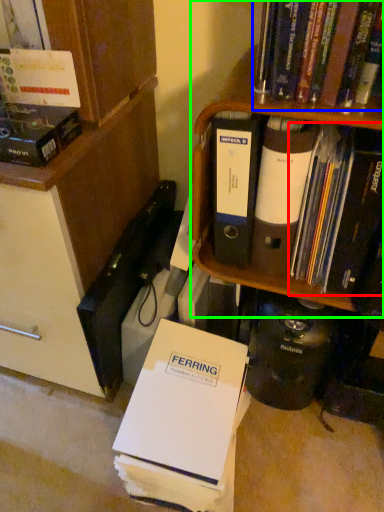
Question: Based on their relative distances, which object is nearer to book (highlighted by a red box)? Choose from book (highlighted by a blue box) and shelf (highlighted by a green box).

Choices:
 (A) book
 (B) shelf

Answer: (B)